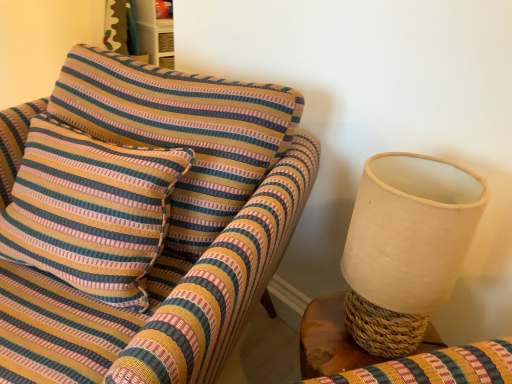
The height and width of the screenshot is (384, 512). Identify the location of free spot above woven wood table at right (from a real-world perspective). click(335, 335).